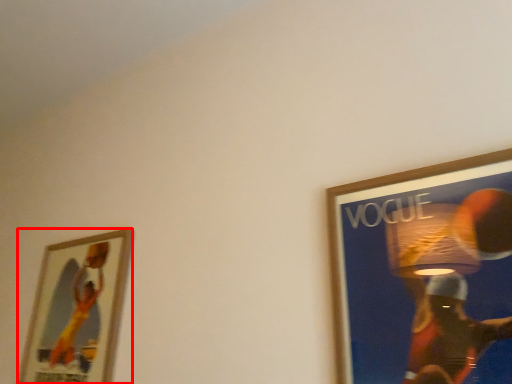
Question: From the image's perspective, what is the correct spatial relationship of picture frame (annotated by the red box) in relation to picture frame?

Choices:
 (A) below
 (B) above

Answer: (A)